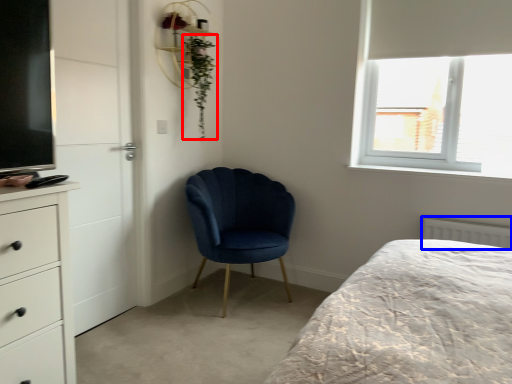
Question: Among these objects, which one is farthest to the camera, plant (highlighted by a red box) or radiator (highlighted by a blue box)?

Choices:
 (A) plant
 (B) radiator

Answer: (A)